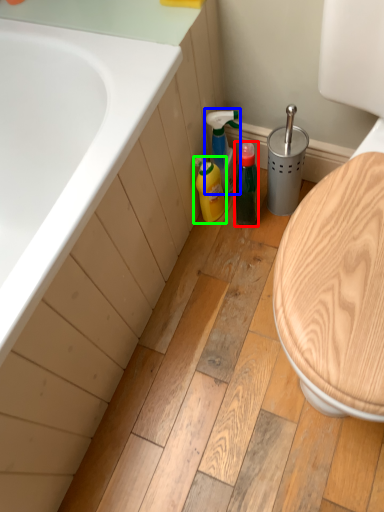
Question: Which object is positioned closest to bottle (highlighted by a red box)? Select from cleaning product (highlighted by a blue box) and cleaning product (highlighted by a green box).

Choices:
 (A) cleaning product
 (B) cleaning product

Answer: (B)